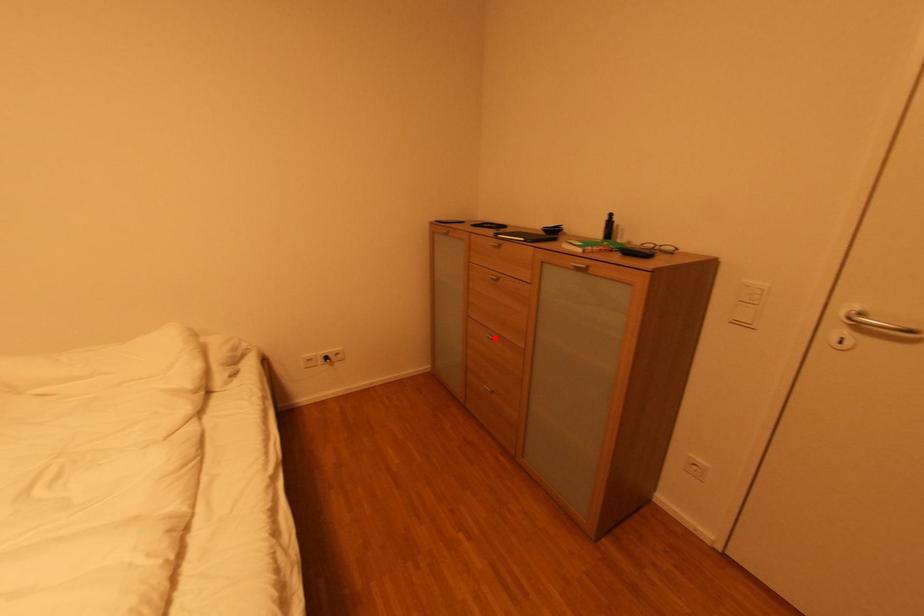
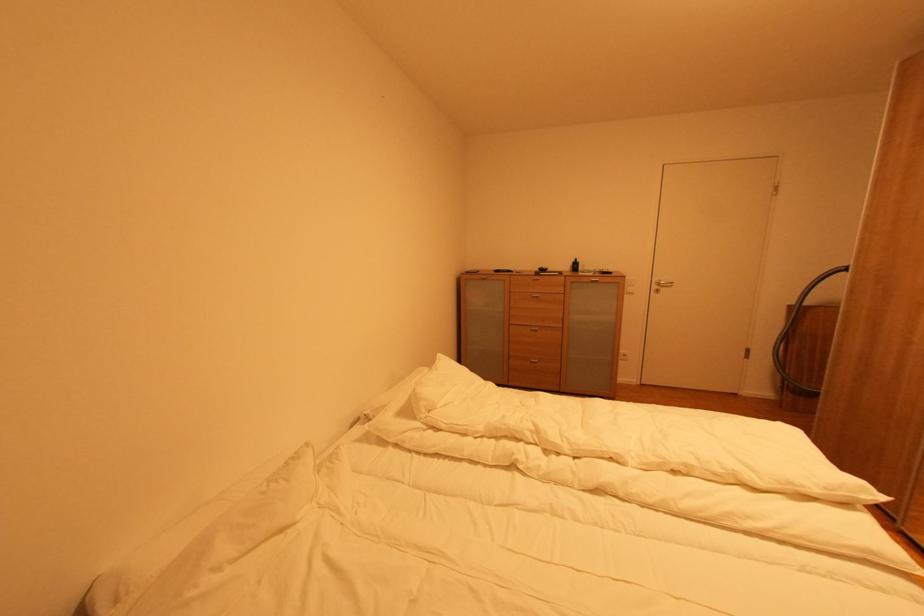
In the second image, find the point that corresponds to the highlighted location in the first image.

(539, 331)